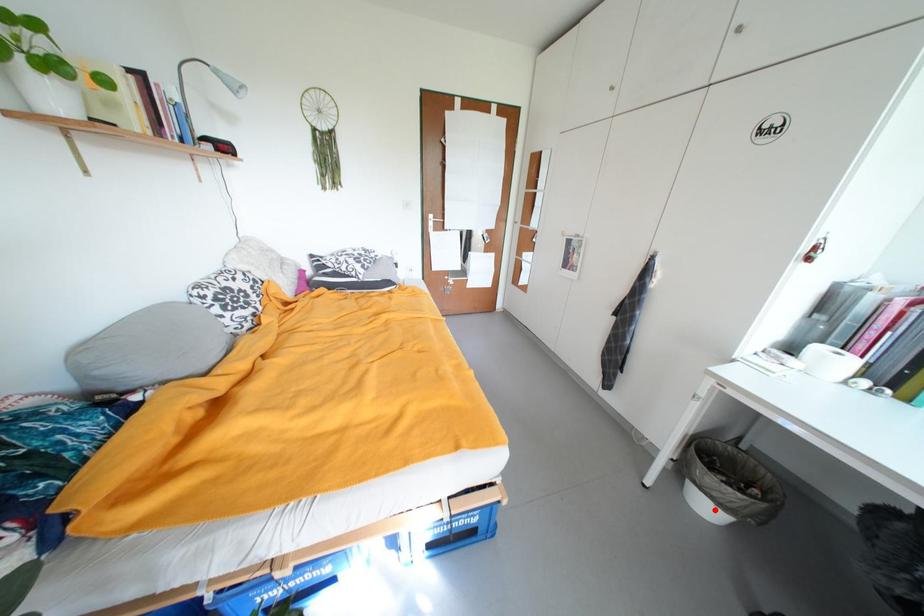
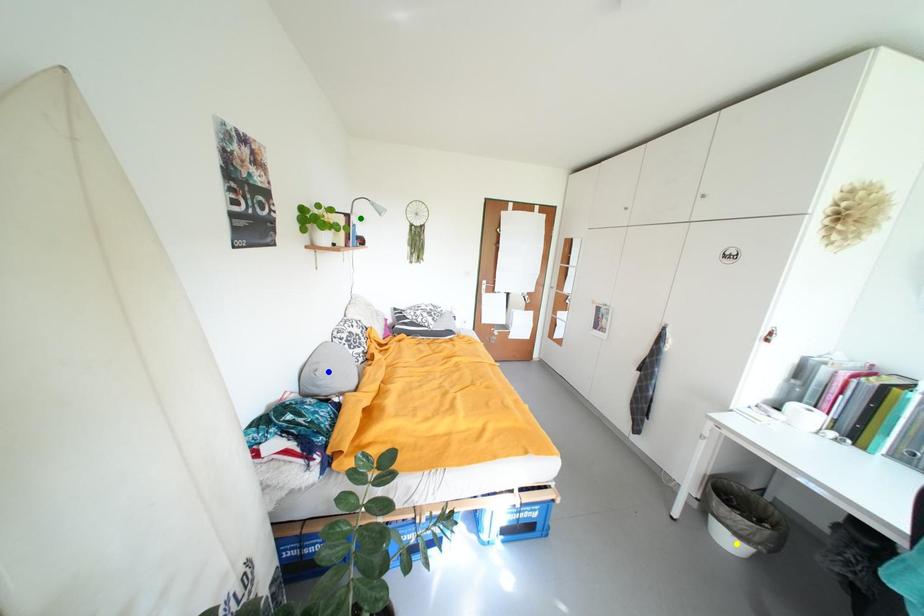
Question: I am providing you with two images of the same scene from different viewpoints. A red point is marked on the first image. You are given multiple points on the second image. Which point in image 2 represents the same 3d spot as the red point in image 1?

Choices:
 (A) blue point
 (B) yellow point
 (C) green point

Answer: (B)